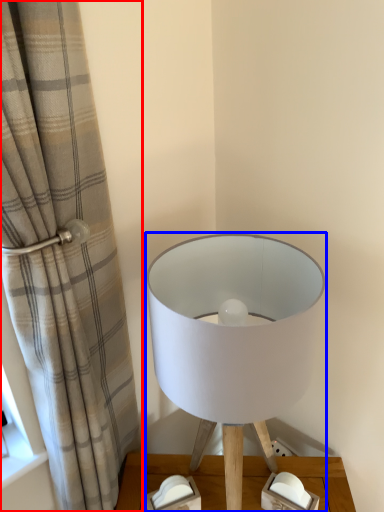
Question: Among these objects, which one is farthest to the camera, curtain (highlighted by a red box) or lamp (highlighted by a blue box)?

Choices:
 (A) curtain
 (B) lamp

Answer: (B)